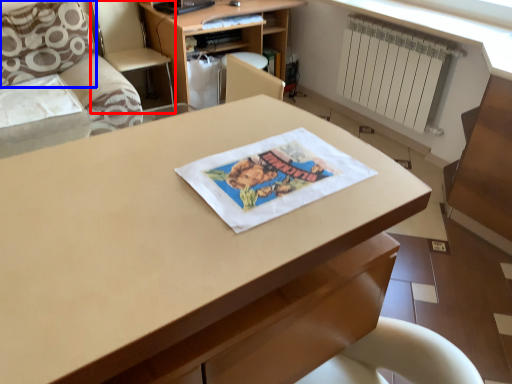
Question: Among these objects, which one is farthest to the camera, armchair (highlighted by a red box) or pillow (highlighted by a blue box)?

Choices:
 (A) armchair
 (B) pillow

Answer: (A)